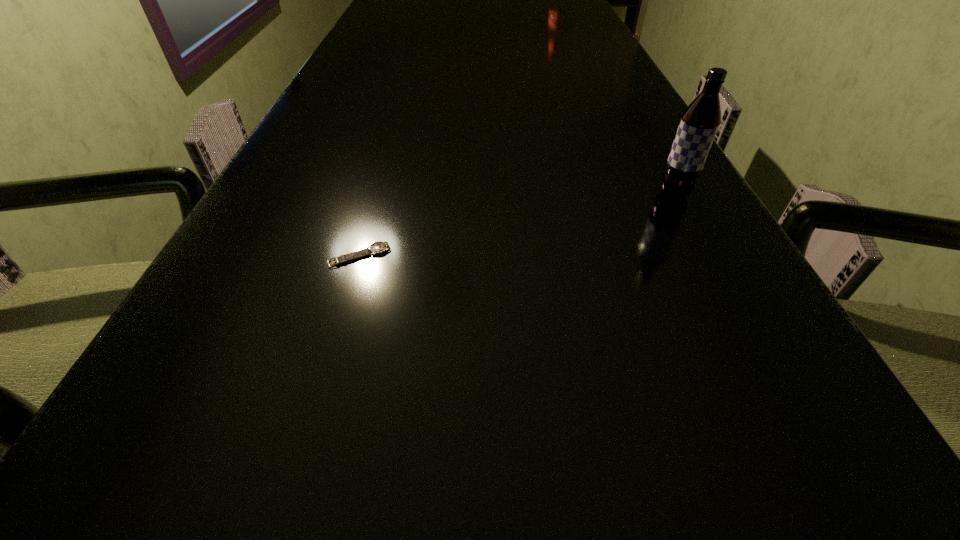
Find the location of a particular element. the right object is located at coordinates point(699,123).

What are the coordinates of `root beer` in the screenshot? It's located at (699, 123).

I want to click on watch, so click(377, 248).

The height and width of the screenshot is (540, 960). Find the location of `the left object`. the left object is located at coordinates (377, 248).

You are a GUI agent. You are given a task and a screenshot of the screen. Output one action in this format:
    pyautogui.click(x=<x>, y=<y>)
    Task: Click on the vacant space located on the left of the root beer
    
    Given the screenshot: What is the action you would take?
    pyautogui.click(x=445, y=194)

I want to click on free location located on the right of the left object, so click(439, 256).

Image resolution: width=960 pixels, height=540 pixels. I want to click on object that is at the left edge, so click(x=377, y=248).

This screenshot has width=960, height=540. Identify the location of object present at the right edge. (699, 123).

What are the coordinates of `vacant region at the left edge of the desktop` in the screenshot? It's located at (371, 30).

The height and width of the screenshot is (540, 960). In the image, there is a desktop. Identify the location of vacant space at the right edge. (745, 293).